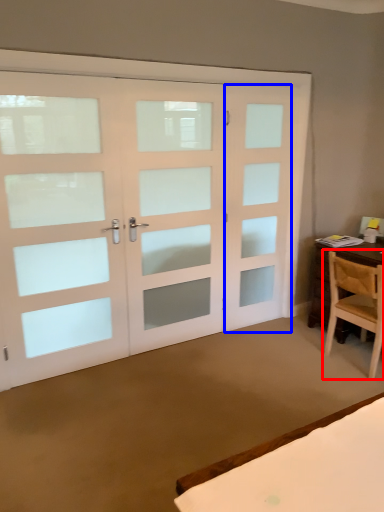
Question: Which point is further to the camera, chair (highlighted by a red box) or screen door (highlighted by a blue box)?

Choices:
 (A) chair
 (B) screen door

Answer: (B)